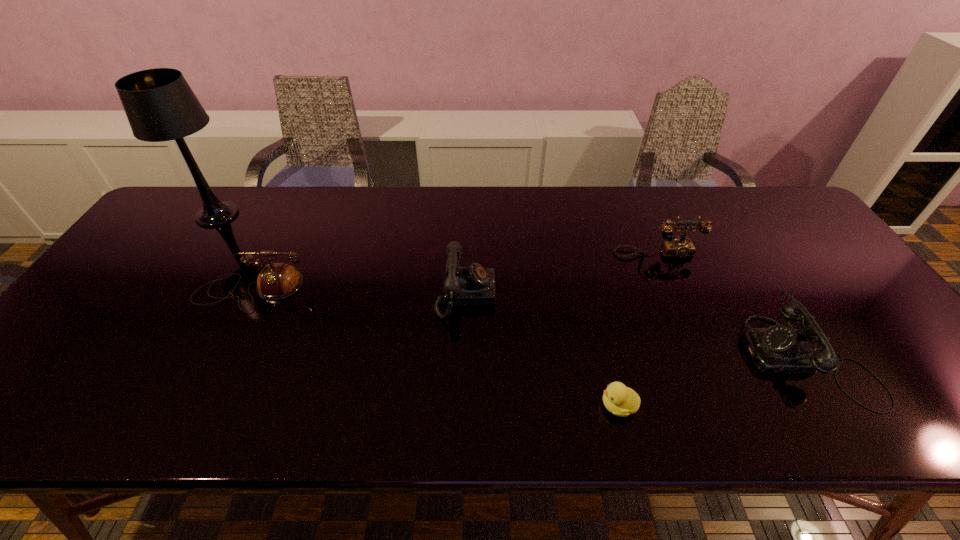
Where is `object positioned at the near right corner`? object positioned at the near right corner is located at coordinates (780, 349).

What are the coordinates of `vacant space at the far edge` in the screenshot? It's located at (516, 229).

The width and height of the screenshot is (960, 540). In order to click on vacant point at the near edge in this screenshot , I will do `click(84, 426)`.

Identify the location of vacant space at the left edge of the desktop. This screenshot has width=960, height=540. (156, 274).

Identify the location of free space between the farthest object and the second telephone from left to right. (342, 255).

The height and width of the screenshot is (540, 960). Find the location of `vacant space that is in between the duckling and the farthest object`. vacant space that is in between the duckling and the farthest object is located at coordinates pos(418,310).

Identify the location of unoccupied position between the tallest object and the second telephone from left to right. coord(342,255).

I want to click on free space between the third object from right to left and the table lamp, so click(418, 310).

The width and height of the screenshot is (960, 540). Find the location of `vacant region between the duckling and the second farthest object`. vacant region between the duckling and the second farthest object is located at coordinates (637, 329).

Find the location of a particular element. empty location between the leftmost telephone and the shortest object is located at coordinates (435, 347).